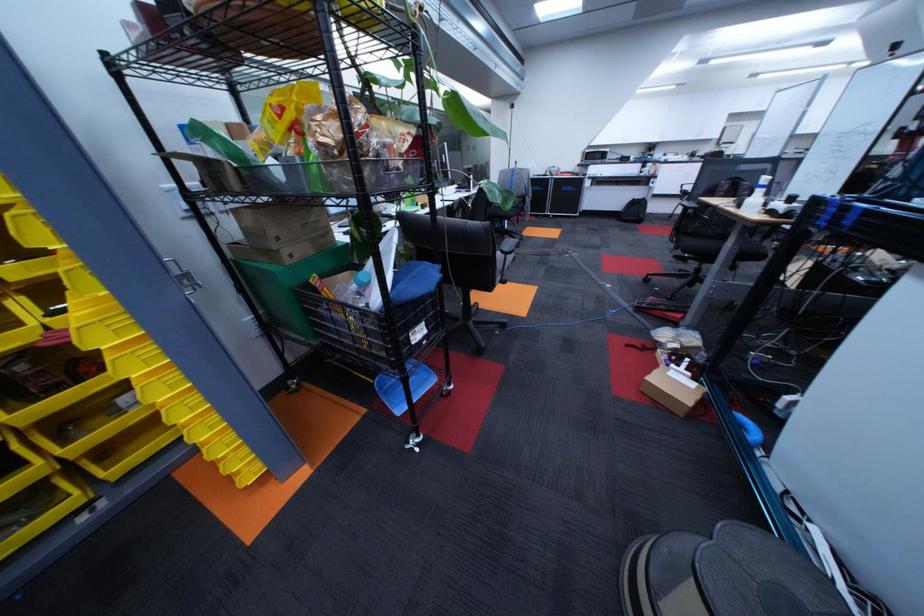
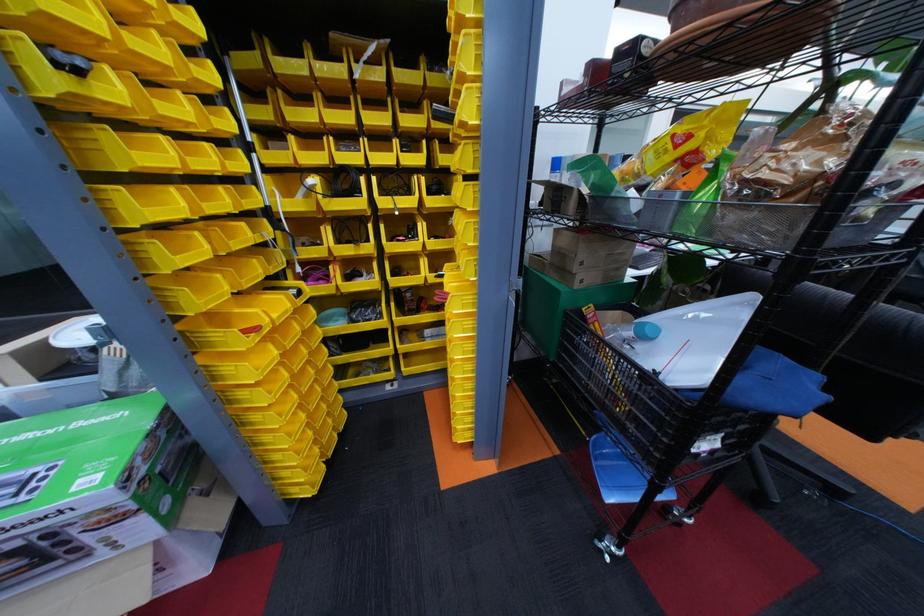
In the second image, find the point that corresponds to (x=78, y=312) in the first image.

(456, 277)